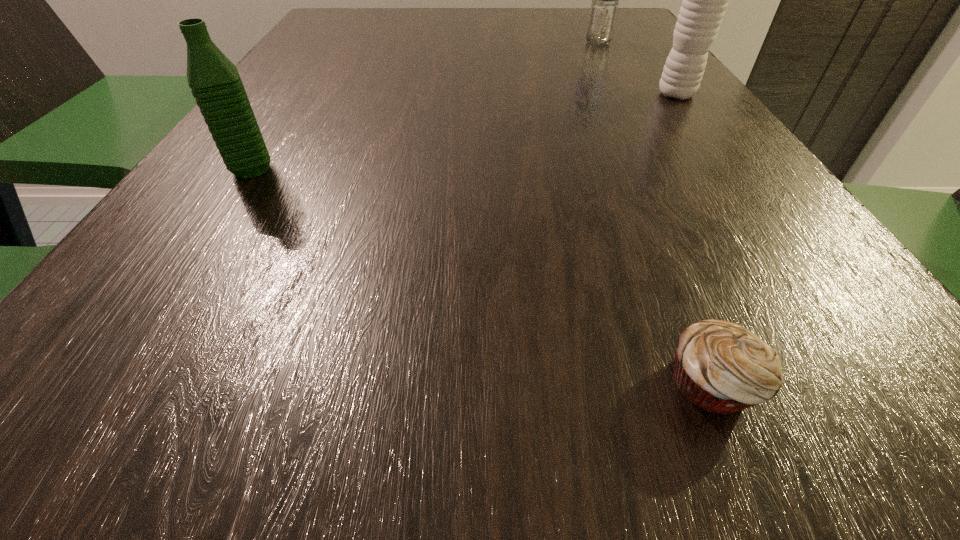
Find the location of `the second nearest water bottle`. the second nearest water bottle is located at coordinates (704, 2).

The width and height of the screenshot is (960, 540). In order to click on the rightmost water bottle in this screenshot , I will do `click(704, 2)`.

The width and height of the screenshot is (960, 540). In order to click on the second water bottle from left to right in this screenshot , I will do `click(603, 11)`.

Identify the location of the farthest object. [x=603, y=11].

The width and height of the screenshot is (960, 540). What are the coordinates of `the nearest water bottle` in the screenshot? It's located at (214, 80).

Image resolution: width=960 pixels, height=540 pixels. Find the location of `the second nearest object`. the second nearest object is located at coordinates (214, 80).

Locate an element on the screen. the shortest object is located at coordinates (721, 367).

Identify the location of muffin. (721, 367).

Find the location of a particular element. This screenshot has height=540, width=960. free space located on the left of the second farthest object is located at coordinates (483, 94).

Where is `vacant point located 0.140m on the front of the second water bottle from left to right`? vacant point located 0.140m on the front of the second water bottle from left to right is located at coordinates (613, 72).